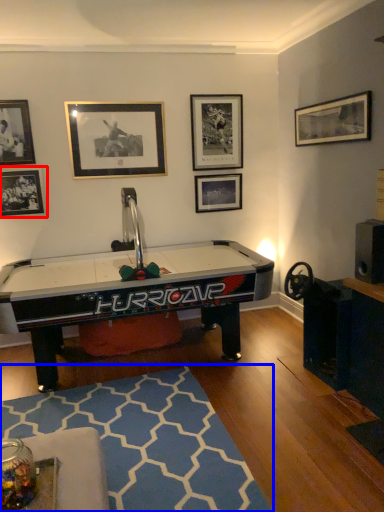
Question: Among these objects, which one is farthest to the camera, picture frame (highlighted by a red box) or mat (highlighted by a blue box)?

Choices:
 (A) picture frame
 (B) mat

Answer: (A)